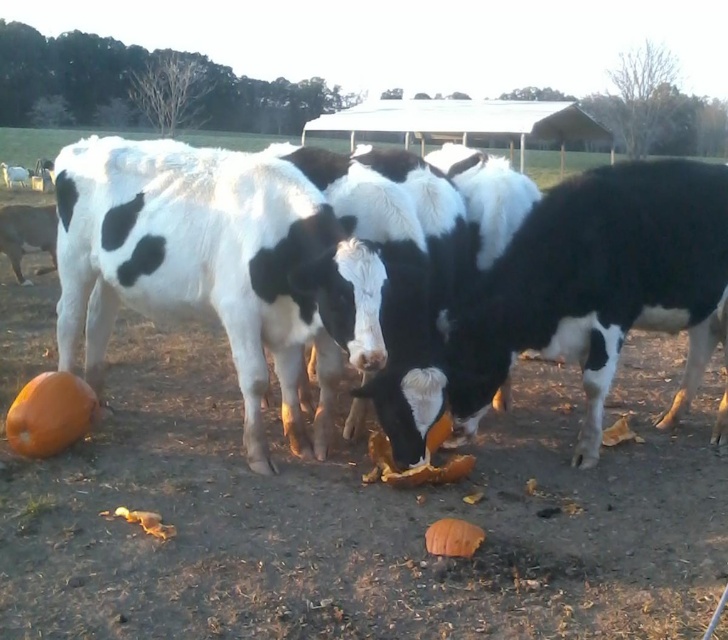
You are standing at the point marked by the coordinates point (405, 404) in the image. What do you see immediately around you?

You are surrounded by black and white spotted cows at center, as the point (405, 404) marks their location.